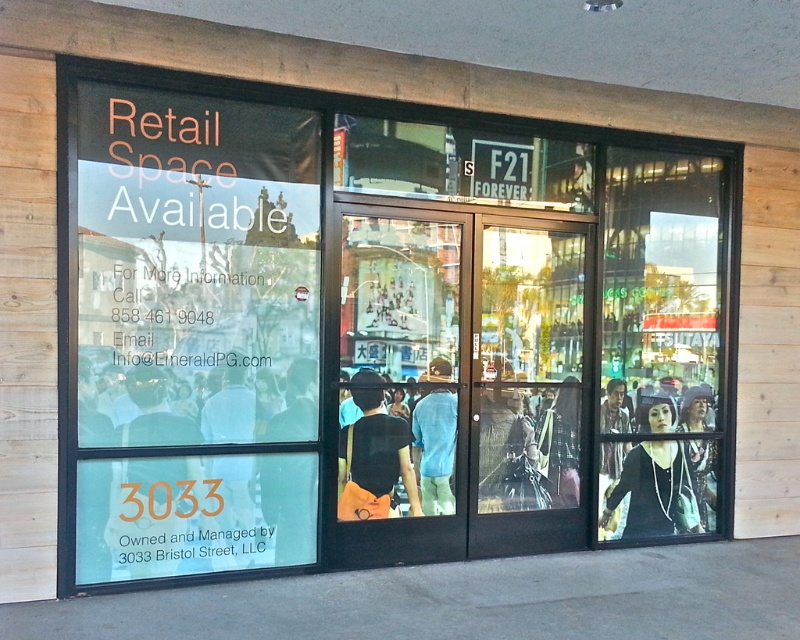
You are a customer standing in front of the commercial building and want to enter through the transparent glass doors at center. To reach them, you need to walk around the transparent glass sign at upper left. Which direction should you move relative to the sign?

The transparent glass sign at upper left is positioned on the left side of the transparent glass doors at center. To reach the doors, you should move to the right side of the sign.